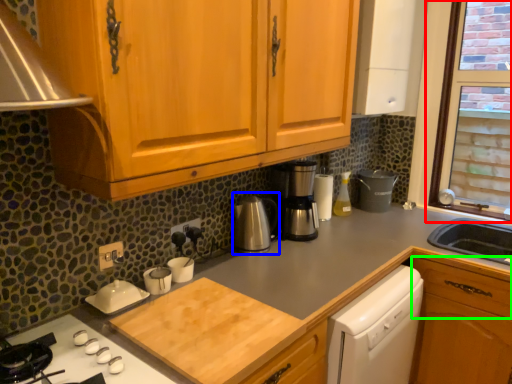
Question: Which object is the farthest from window (highlighted by a red box)? Choose among these: coffeepot (highlighted by a blue box) or drawer (highlighted by a green box).

Choices:
 (A) coffeepot
 (B) drawer

Answer: (A)